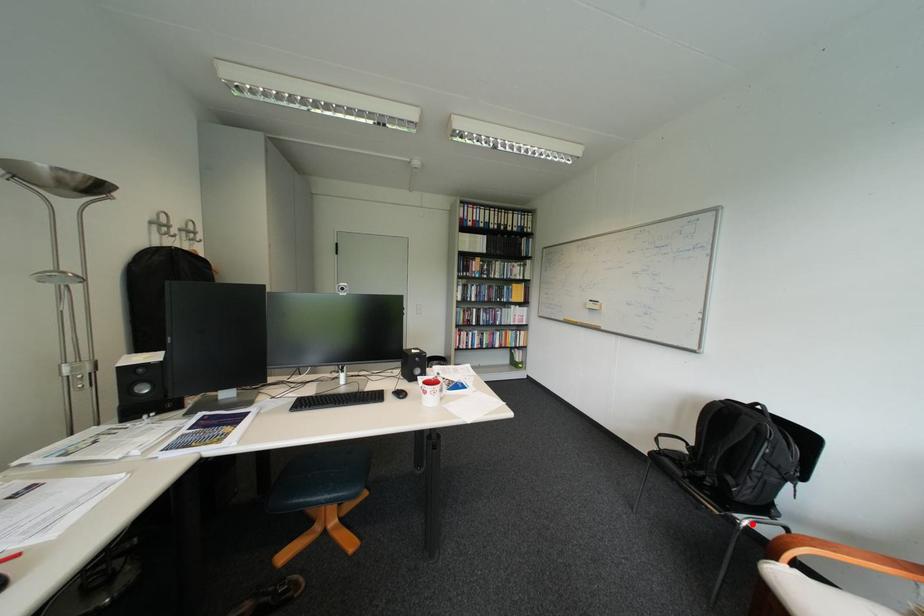
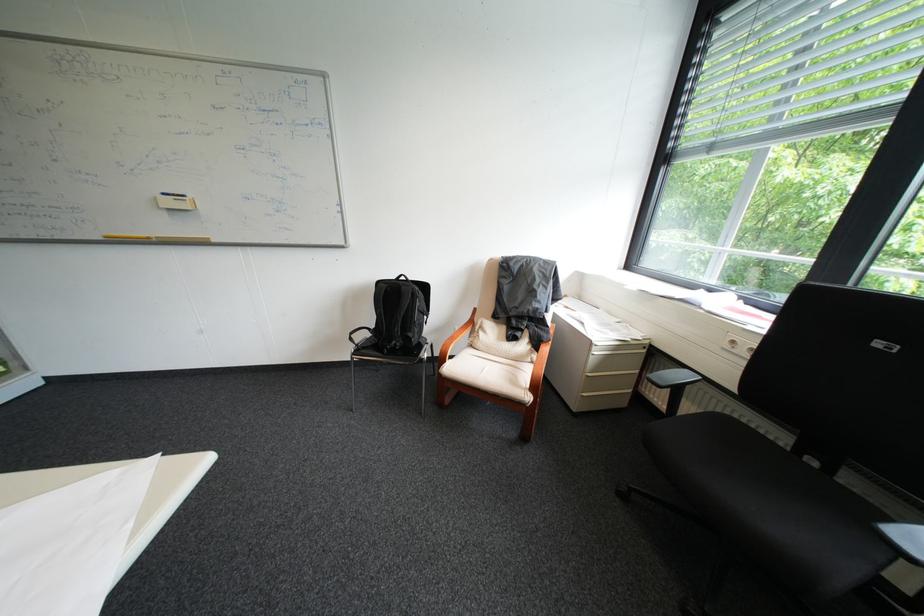
Question: A red point is marked in image1. In image2, is the corresponding 3D point closer to the camera or farther? Reply with the corresponding letter.

Choices:
 (A) The corresponding 3D point is closer.
 (B) The corresponding 3D point is farther.

Answer: (B)